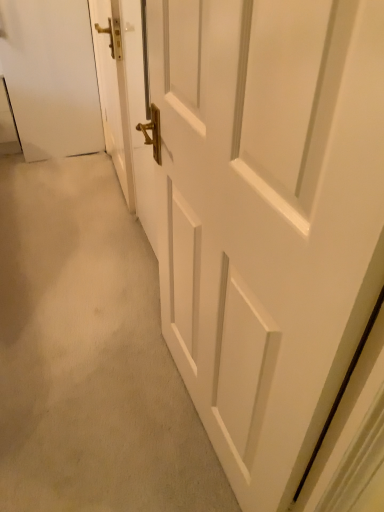
Question: Is white matte door at center, the 2th door positioned from the left, oriented away from white wooden door at left, positioned as the 1th door in left-to-right order?

Choices:
 (A) yes
 (B) no

Answer: (B)

Question: Would you consider white matte door at center, the first door positioned from the right, to be distant from white wooden door at left, which is the 2th door in right-to-left order?

Choices:
 (A) no
 (B) yes

Answer: (B)

Question: Is white matte door at center, the first door positioned from the right, further to camera compared to white wooden door at left, positioned as the 1th door in left-to-right order?

Choices:
 (A) no
 (B) yes

Answer: (A)

Question: Can you confirm if white matte door at center, the first door positioned from the right, is smaller than white wooden door at left, positioned as the 1th door in left-to-right order?

Choices:
 (A) yes
 (B) no

Answer: (B)

Question: Considering the relative positions of white matte door at center, the first door positioned from the right, and white wooden door at left, positioned as the 1th door in left-to-right order, in the image provided, is white matte door at center, the first door positioned from the right, to the right of white wooden door at left, positioned as the 1th door in left-to-right order, from the viewer's perspective?

Choices:
 (A) yes
 (B) no

Answer: (A)

Question: Is white matte door at center, the first door positioned from the right, outside of white wooden door at left, which is the 2th door in right-to-left order?

Choices:
 (A) yes
 (B) no

Answer: (A)

Question: Does white wooden door at left, which is the 2th door in right-to-left order, have a lesser height compared to white matte door at center, the 2th door positioned from the left?

Choices:
 (A) yes
 (B) no

Answer: (A)

Question: Is white wooden door at left, positioned as the 1th door in left-to-right order, at the left side of white matte door at center, the 2th door positioned from the left?

Choices:
 (A) no
 (B) yes

Answer: (B)

Question: Is white wooden door at left, which is the 2th door in right-to-left order, not near white matte door at center, the first door positioned from the right?

Choices:
 (A) no
 (B) yes

Answer: (B)

Question: Is white wooden door at left, positioned as the 1th door in left-to-right order, closer to the viewer compared to white matte door at center, the 2th door positioned from the left?

Choices:
 (A) yes
 (B) no

Answer: (B)

Question: From the image's perspective, is white wooden door at left, positioned as the 1th door in left-to-right order, above white matte door at center, the first door positioned from the right?

Choices:
 (A) no
 (B) yes

Answer: (B)

Question: From a real-world perspective, does white wooden door at left, positioned as the 1th door in left-to-right order, sit lower than white matte door at center, the first door positioned from the right?

Choices:
 (A) yes
 (B) no

Answer: (A)

Question: In terms of width, does white wooden door at left, positioned as the 1th door in left-to-right order, look wider or thinner when compared to white matte door at center, the 2th door positioned from the left?

Choices:
 (A) wide
 (B) thin

Answer: (B)